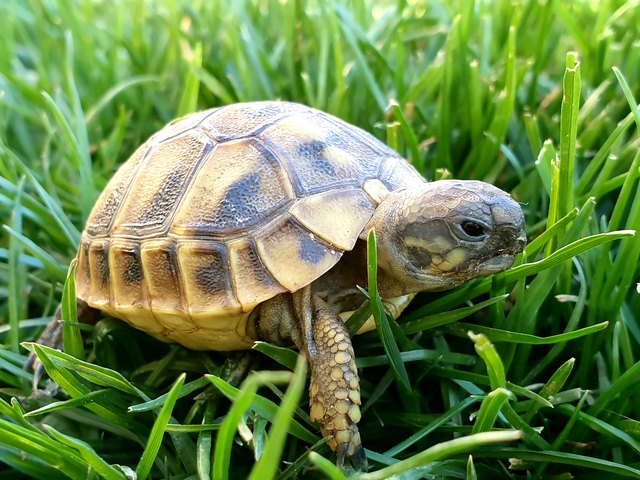
Where is `scales`? scales is located at coordinates (460, 201).